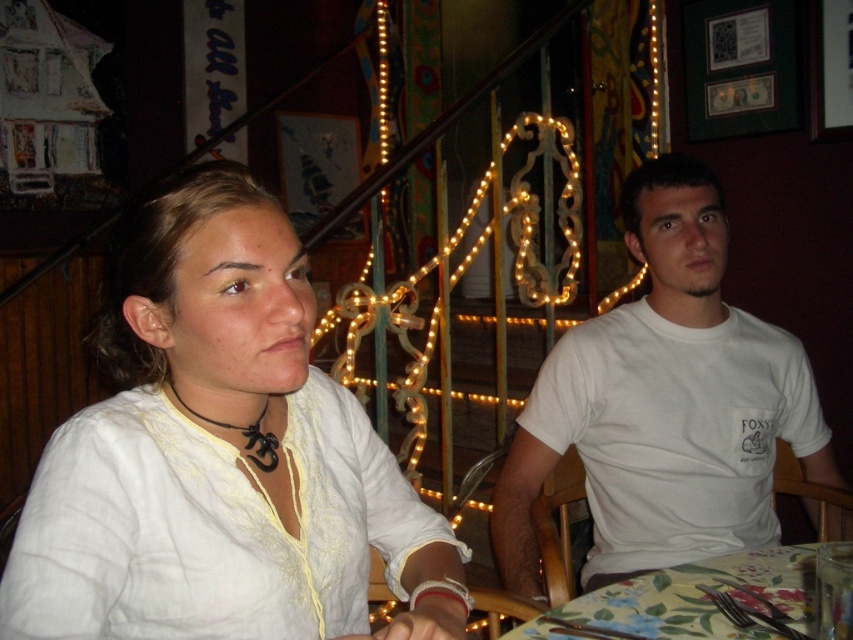
Question: Which object is closer to the camera taking this photo?

Choices:
 (A) white cotton shirt at upper left
 (B) floral fabric tablecloth at lower center

Answer: (A)

Question: Among these objects, which one is farthest from the camera?

Choices:
 (A) white cotton t-shirt at right
 (B) white cotton shirt at upper left

Answer: (A)

Question: From the image, what is the correct spatial relationship of white cotton t-shirt at right in relation to floral fabric tablecloth at lower center?

Choices:
 (A) left
 (B) right

Answer: (B)

Question: Considering the relative positions of white cotton shirt at upper left and floral fabric tablecloth at lower center in the image provided, where is white cotton shirt at upper left located with respect to floral fabric tablecloth at lower center?

Choices:
 (A) left
 (B) right

Answer: (A)

Question: Can you confirm if white cotton t-shirt at right is positioned above floral fabric tablecloth at lower center?

Choices:
 (A) yes
 (B) no

Answer: (A)

Question: Which of these objects is positioned farthest from the white cotton t-shirt at right?

Choices:
 (A) white cotton shirt at upper left
 (B) floral fabric tablecloth at lower center

Answer: (A)